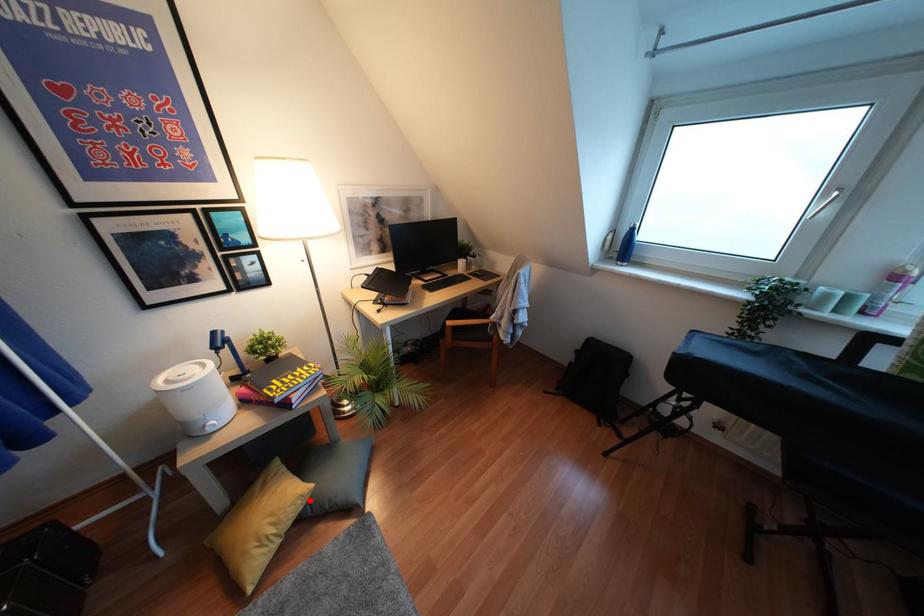
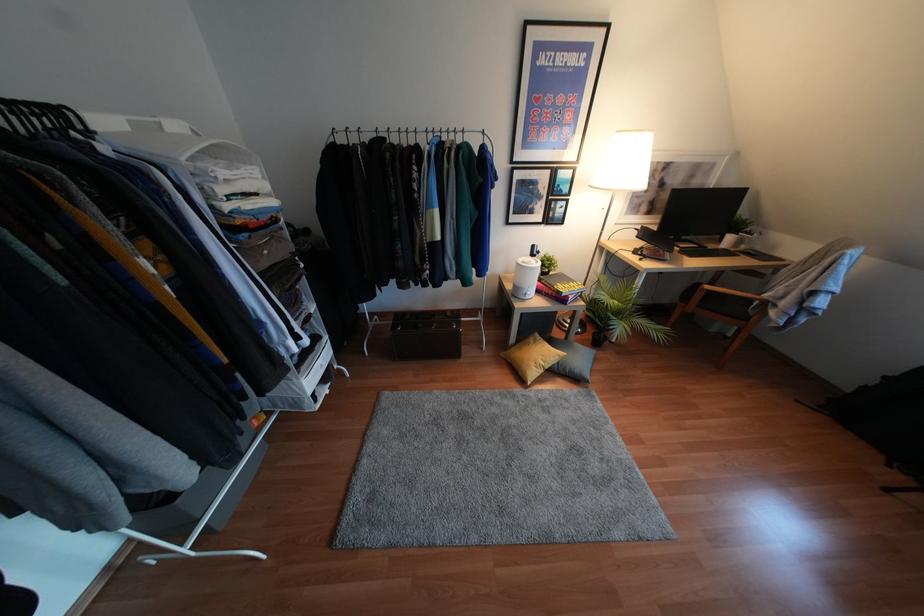
Question: I am providing you with two images of the same scene from different viewpoints. Image1 has a red point marked. In image2, the corresponding 3D location appears at what relative position? Reply with the corresponding letter.

Choices:
 (A) Closer
 (B) Farther

Answer: (A)